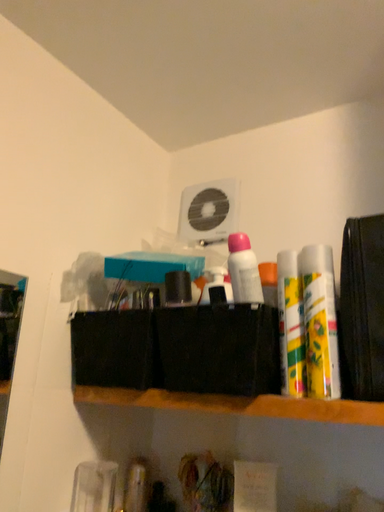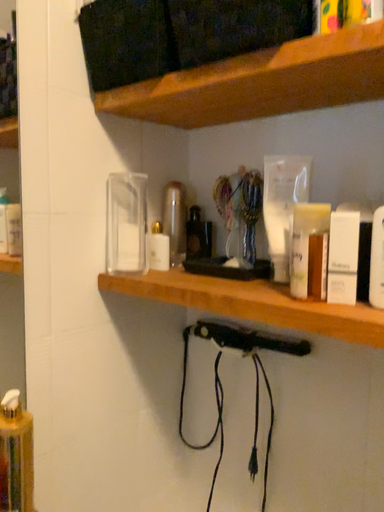
Question: Which way did the camera rotate in the video?

Choices:
 (A) rotated right
 (B) rotated left

Answer: (B)